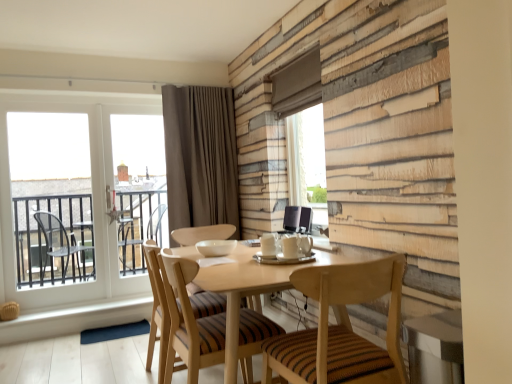
Question: Is white glass window at left located within light wood textured chair at center, arranged as the first chair when viewed from the left?

Choices:
 (A) yes
 (B) no

Answer: (B)

Question: From the image's perspective, is light wood textured chair at center, arranged as the first chair when viewed from the left, on white glass window at left?

Choices:
 (A) no
 (B) yes

Answer: (A)

Question: Does light wood textured chair at center, which is the 2th chair from right to left, have a lesser height compared to white glass window at left?

Choices:
 (A) no
 (B) yes

Answer: (B)

Question: Can you confirm if light wood textured chair at center, which is the 2th chair from right to left, is smaller than white glass window at left?

Choices:
 (A) no
 (B) yes

Answer: (A)

Question: From a real-world perspective, is light wood textured chair at center, arranged as the first chair when viewed from the left, located beneath white glass window at left?

Choices:
 (A) no
 (B) yes

Answer: (B)

Question: Is light wood textured chair at center, which is the 2th chair from right to left, oriented away from white glass window at left?

Choices:
 (A) no
 (B) yes

Answer: (A)

Question: From the image's perspective, is transparent glass window screen at upper center, arranged as the second window screen when viewed from the left, beneath transparent glass door at left, which ranks as the first window screen in back-to-front order?

Choices:
 (A) no
 (B) yes

Answer: (A)

Question: Could you tell me if transparent glass window screen at upper center, the 1th window screen from the front, is turned towards transparent glass door at left, which is the first window screen in left-to-right order?

Choices:
 (A) no
 (B) yes

Answer: (A)

Question: Considering the relative sizes of transparent glass window screen at upper center, the 1th window screen from the front, and transparent glass door at left, which is the second window screen from front to back, in the image provided, is transparent glass window screen at upper center, the 1th window screen from the front, smaller than transparent glass door at left, which is the second window screen from front to back,?

Choices:
 (A) yes
 (B) no

Answer: (A)

Question: Is transparent glass window screen at upper center, the 2th window screen viewed from the back, touching transparent glass door at left, which is the first window screen in left-to-right order?

Choices:
 (A) no
 (B) yes

Answer: (A)

Question: Does transparent glass window screen at upper center, arranged as the second window screen when viewed from the left, have a lesser height compared to transparent glass door at left, which ranks as the first window screen in back-to-front order?

Choices:
 (A) no
 (B) yes

Answer: (B)

Question: Would you say transparent glass window screen at upper center, the 2th window screen viewed from the back, is outside transparent glass door at left, which ranks as the second window screen in right-to-left order?

Choices:
 (A) no
 (B) yes

Answer: (B)

Question: Considering the relative positions of brown velvet curtain at upper center and light wood textured chair at center, which is the 2th chair from right to left, in the image provided, is brown velvet curtain at upper center to the right of light wood textured chair at center, which is the 2th chair from right to left, from the viewer's perspective?

Choices:
 (A) yes
 (B) no

Answer: (B)